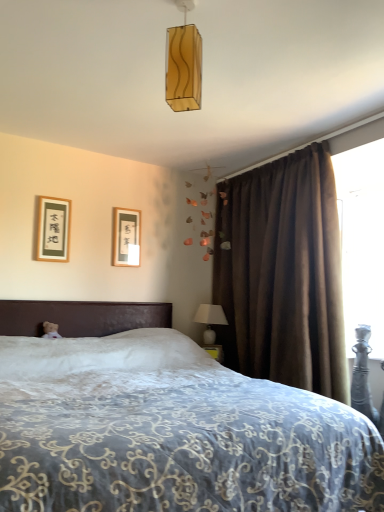
Question: From the image's perspective, relative to matte black picture frame at upper left, which is counted as the second picture frame, starting from the right, is white plush teddy bear at left above or below?

Choices:
 (A) below
 (B) above

Answer: (A)

Question: In the image, is white plush teddy bear at left on the left side or the right side of matte black picture frame at upper left, which is counted as the second picture frame, starting from the right?

Choices:
 (A) right
 (B) left

Answer: (A)

Question: Estimate the real-world distances between objects in this image. Which object is closer to the white embroidered bed at center?

Choices:
 (A) white plush teddy bear at left
 (B) brown velvet curtain at right
 (C) transparent plastic screen at upper right
 (D) metallic silver swivel chair at lower right
 (E) wooden picture frame at upper left, marked as the 2th picture frame in a front-to-back arrangement

Answer: (B)

Question: Estimate the real-world distances between objects in this image. Which object is closer to the transparent plastic screen at upper right?

Choices:
 (A) metallic silver swivel chair at lower right
 (B) white ceramic table lamp at right
 (C) white plush teddy bear at left
 (D) translucent amber glass rectangular pendant light at upper center
 (E) matte black picture frame at upper left, which is the first picture frame in front-to-back order

Answer: (A)